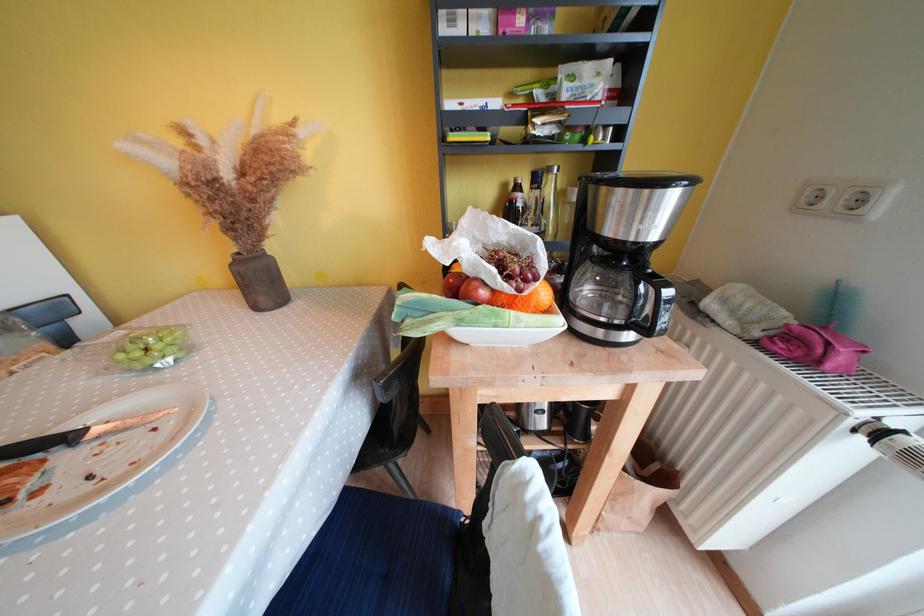
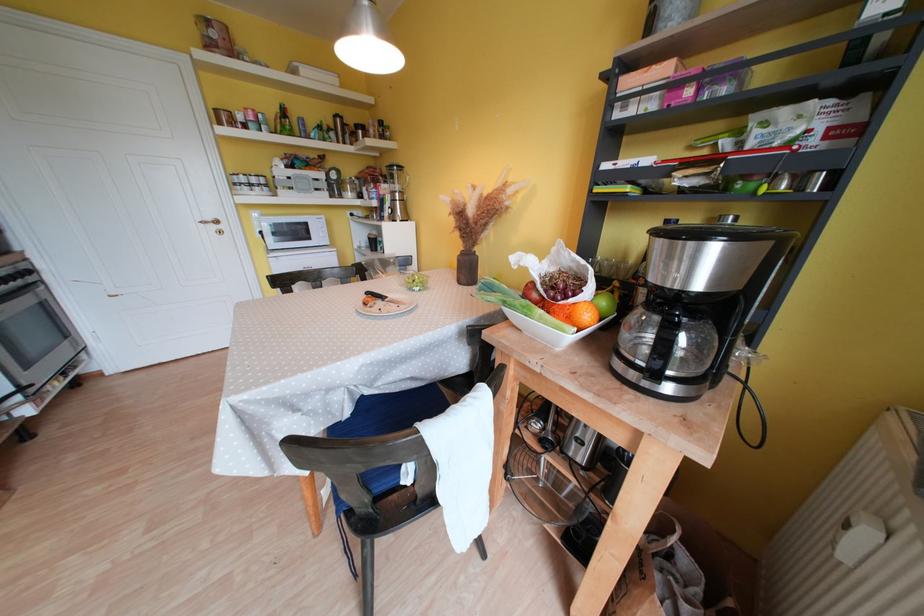
Where in the second image is the point corresponding to the point at 78,442 from the first image?

(390, 301)